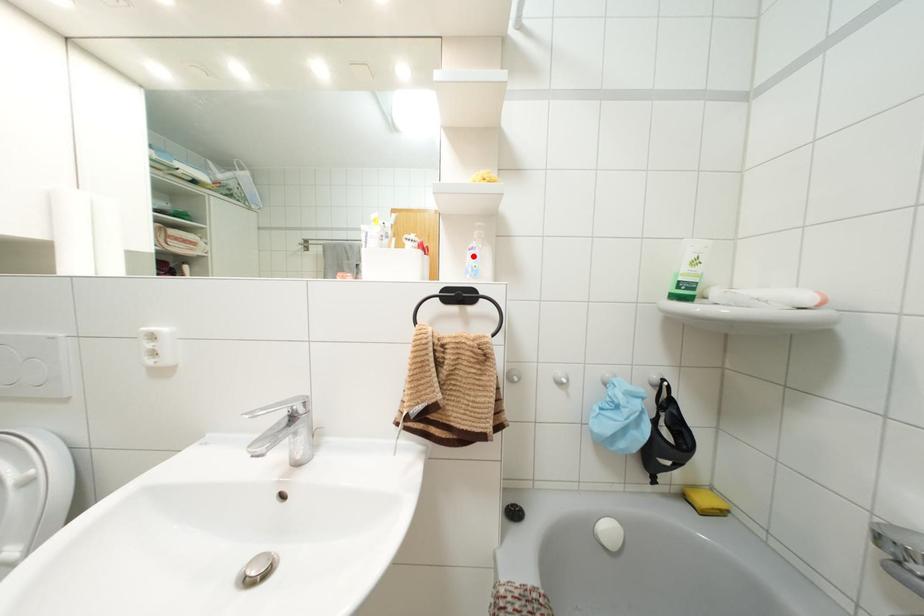
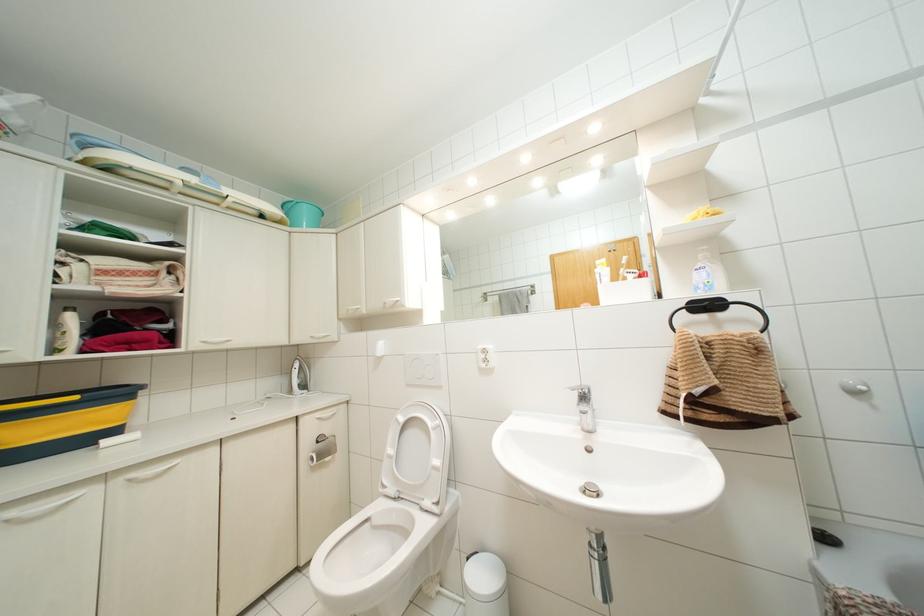
Question: I am providing you with two images of the same scene from different viewpoints. A red point is marked on the first image. Is the red point's position out of view in image 2?

Choices:
 (A) Yes
 (B) No

Answer: (B)